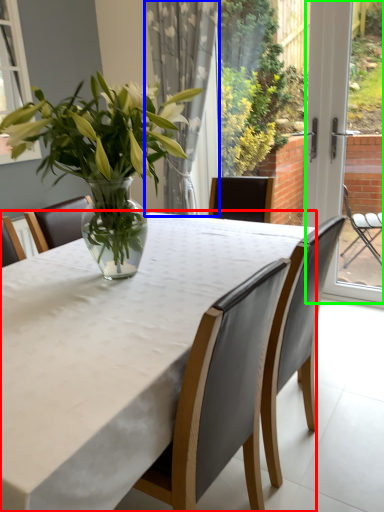
Question: Which object is positioned closest to table (highlighted by a red box)? Select from curtain (highlighted by a blue box) and screen door (highlighted by a green box).

Choices:
 (A) curtain
 (B) screen door

Answer: (A)